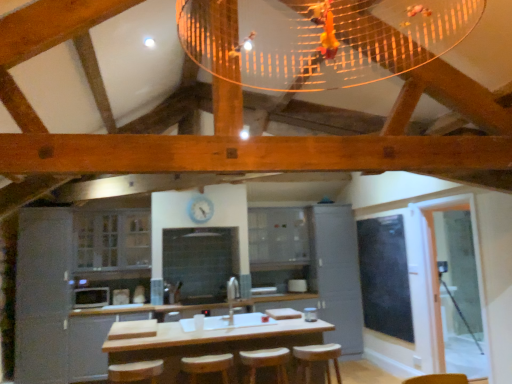
Describe the element at coordinates (42, 295) in the screenshot. I see `satin grey cabinet at left, positioned as the 1th cabinetry in left-to-right order` at that location.

Measure the distance between white plastic clock at upper center and camera.

The distance of white plastic clock at upper center from camera is 6.33 meters.

What are the coordinates of `wooden bar stool at center, the first bar stool in the left-to-right sequence` in the screenshot? It's located at (207, 366).

Where is `clear glass cabinet at center, marked as the 2th cabinetry in a right-to-left arrangement`? This screenshot has width=512, height=384. clear glass cabinet at center, marked as the 2th cabinetry in a right-to-left arrangement is located at coordinates (278, 235).

The height and width of the screenshot is (384, 512). Find the location of `clear glass screen door at right`. clear glass screen door at right is located at coordinates (455, 292).

Locate an element on the screen. clear glass cabinets at center, acting as the 3th cabinetry starting from the right is located at coordinates (112, 239).

Is satin grey cabinet at left, positioned as the 1th cabinetry in left-to-right order, positioned far away from matte gray cabinet at center, the fourth cabinetry from the left?

Indeed, satin grey cabinet at left, positioned as the 1th cabinetry in left-to-right order, is not near matte gray cabinet at center, the fourth cabinetry from the left.

Which point is more forward, (47, 258) or (311, 272)?

The point (311, 272) is in front.

Does satin grey cabinet at left, positioned as the 1th cabinetry in left-to-right order, have a smaller size compared to matte gray cabinet at center, the fourth cabinetry from the left?

Yes.

From a real-world perspective, is satin grey cabinet at left, positioned as the 1th cabinetry in left-to-right order, physically located above or below matte gray cabinet at center, the fourth cabinetry from the left?

Clearly, from a real-world perspective, satin grey cabinet at left, positioned as the 1th cabinetry in left-to-right order, is above matte gray cabinet at center, the fourth cabinetry from the left.

Can you confirm if white plastic clock at upper center is shorter than matte gray cabinet at center, the fourth cabinetry from the left?

Yes.

From the image's perspective, is white plastic clock at upper center on matte gray cabinet at center, the fourth cabinetry from the left?

Correct, white plastic clock at upper center appears higher than matte gray cabinet at center, the fourth cabinetry from the left, in the image.

Between white plastic clock at upper center and matte gray cabinet at center, the fourth cabinetry from the left, which one has larger width?

Wider between the two is matte gray cabinet at center, the fourth cabinetry from the left.

Which is closer to the camera, (316, 275) or (277, 260)?

Point (316, 275) is positioned closer to the camera compared to point (277, 260).

Is the position of matte gray cabinet at center, arranged as the 1th cabinetry when viewed from the right, more distant than that of clear glass cabinet at center, the third cabinetry viewed from the left?

That is False.

Is matte gray cabinet at center, arranged as the 1th cabinetry when viewed from the right, smaller than clear glass cabinet at center, marked as the 2th cabinetry in a right-to-left arrangement?

Actually, matte gray cabinet at center, arranged as the 1th cabinetry when viewed from the right, might be larger than clear glass cabinet at center, marked as the 2th cabinetry in a right-to-left arrangement.

Where is `the 3rd cabinetry located above the matte gray cabinet at center, the fourth cabinetry from the left (from a real-world perspective)`? The image size is (512, 384). the 3rd cabinetry located above the matte gray cabinet at center, the fourth cabinetry from the left (from a real-world perspective) is located at coordinates (278, 235).

In terms of size, does white plastic clock at upper center appear bigger or smaller than black glass window screen at right?

Clearly, white plastic clock at upper center is smaller in size than black glass window screen at right.

Is white plastic clock at upper center not within black glass window screen at right?

white plastic clock at upper center lies outside black glass window screen at right's area.

Is white plastic clock at upper center oriented towards black glass window screen at right?

No, white plastic clock at upper center does not turn towards black glass window screen at right.

Considering the points (212, 204) and (384, 333), which point is behind, point (212, 204) or point (384, 333)?

The point (212, 204) is farther.

Based on the photo, is black glass window screen at right at the back of white glossy microwave at lower left?

No, white glossy microwave at lower left's orientation is not away from black glass window screen at right.

Are white glossy microwave at lower left and black glass window screen at right located far from each other?

That's right, there is a large distance between white glossy microwave at lower left and black glass window screen at right.

Choose the correct answer: Is white glossy microwave at lower left inside black glass window screen at right or outside it?

white glossy microwave at lower left is outside black glass window screen at right.

Is point (101, 298) farther from camera compared to point (320, 350)?

Yes, it is behind point (320, 350).

Does white glossy microwave at lower left have a lesser width compared to wooden bar stool at center, marked as the first bar stool in a right-to-left arrangement?

Indeed, white glossy microwave at lower left has a lesser width compared to wooden bar stool at center, marked as the first bar stool in a right-to-left arrangement.

From the picture: Considering the positions of objects white glossy microwave at lower left and wooden bar stool at center, marked as the first bar stool in a right-to-left arrangement, in the image provided, who is behind, white glossy microwave at lower left or wooden bar stool at center, marked as the first bar stool in a right-to-left arrangement,?

white glossy microwave at lower left is further from the camera.

Can you confirm if black glass window screen at right is bigger than wooden bar stool at center, the third bar stool from the right?

Yes.

From the image's perspective, is black glass window screen at right positioned above or below wooden bar stool at center, the first bar stool in the left-to-right sequence?

black glass window screen at right is situated higher than wooden bar stool at center, the first bar stool in the left-to-right sequence, in the image.

Is there a large distance between black glass window screen at right and wooden bar stool at center, the first bar stool in the left-to-right sequence?

Indeed, black glass window screen at right is not near wooden bar stool at center, the first bar stool in the left-to-right sequence.

Does black glass window screen at right have a greater width compared to wooden bar stool at center, the third bar stool from the right?

No.

Image resolution: width=512 pixels, height=384 pixels. Find the location of `the 3rd cabinetry counting from the right side of the satin grey cabinet at left, positioned as the 1th cabinetry in left-to-right order`. the 3rd cabinetry counting from the right side of the satin grey cabinet at left, positioned as the 1th cabinetry in left-to-right order is located at coordinates (337, 273).

Which cabinetry is the 1st one when counting from the back of the white plastic clock at upper center? Please provide its 2D coordinates.

[(337, 273)]

Looking at the image, which one is located closer to clear glass screen door at right, white glossy microwave at lower left or wooden bar stool at center, the third bar stool in the left-to-right sequence?

wooden bar stool at center, the third bar stool in the left-to-right sequence.

Based on the photo, looking at the image, which one is located further to black glass window screen at right, clear glass cabinet at center, marked as the 2th cabinetry in a right-to-left arrangement, or wooden bar stool at center, the third bar stool from the right?

Among the two, wooden bar stool at center, the third bar stool from the right, is located further to black glass window screen at right.

Considering their positions, is wooden bar stool at center, the second bar stool viewed from the left, positioned further to wooden bar stool at center, the third bar stool in the left-to-right sequence, than wooden counter at center?

The object further to wooden bar stool at center, the third bar stool in the left-to-right sequence, is wooden counter at center.

When comparing their distances from clear glass cabinet at center, marked as the 2th cabinetry in a right-to-left arrangement, does wooden counter at center or wooden bar stool at center, the third bar stool from the right, seem further?

Based on the image, wooden bar stool at center, the third bar stool from the right, appears to be further to clear glass cabinet at center, marked as the 2th cabinetry in a right-to-left arrangement.

From the image, which object appears to be farther from white glossy microwave at lower left, clear glass cabinets at center, the second cabinetry when ordered from left to right, or satin grey cabinet at left, positioned as the 1th cabinetry in left-to-right order?

The object further to white glossy microwave at lower left is clear glass cabinets at center, the second cabinetry when ordered from left to right.

Looking at the image, which one is located closer to wooden bar stool at center, marked as the first bar stool in a right-to-left arrangement, white glossy microwave at lower left or satin grey cabinet at left, positioned as the 1th cabinetry in left-to-right order?

white glossy microwave at lower left.

Which object lies nearer to the anchor point wooden bar stool at center, the second bar stool viewed from the left, clear glass screen door at right or wooden counter at center?

The object closer to wooden bar stool at center, the second bar stool viewed from the left, is wooden counter at center.

Which object lies further to the anchor point wooden bar stool at center, the third bar stool from the right, wooden counter at center or black glass window screen at right?

The object further to wooden bar stool at center, the third bar stool from the right, is black glass window screen at right.

At what (x,y) coordinates should I click in order to perform the action: click on counter located between white glossy microwave at lower left and clear glass screen door at right in the left-right direction. Please return your answer as a coordinate pair (x, y). The height and width of the screenshot is (384, 512). Looking at the image, I should click on (208, 342).

This screenshot has height=384, width=512. I want to click on clock located between satin grey cabinet at left, the 4th cabinetry viewed from the right, and wooden bar stool at center, the third bar stool in the left-to-right sequence, in the left-right direction, so click(200, 209).

Locate an element on the screen. The image size is (512, 384). counter between wooden bar stool at center, the third bar stool from the right, and matte gray cabinet at center, arranged as the 1th cabinetry when viewed from the right, along the z-axis is located at coordinates (208, 342).

I want to click on window screen between wooden bar stool at center, acting as the second bar stool starting from the right, and clear glass cabinet at center, marked as the 2th cabinetry in a right-to-left arrangement, in the front-back direction, so click(385, 276).